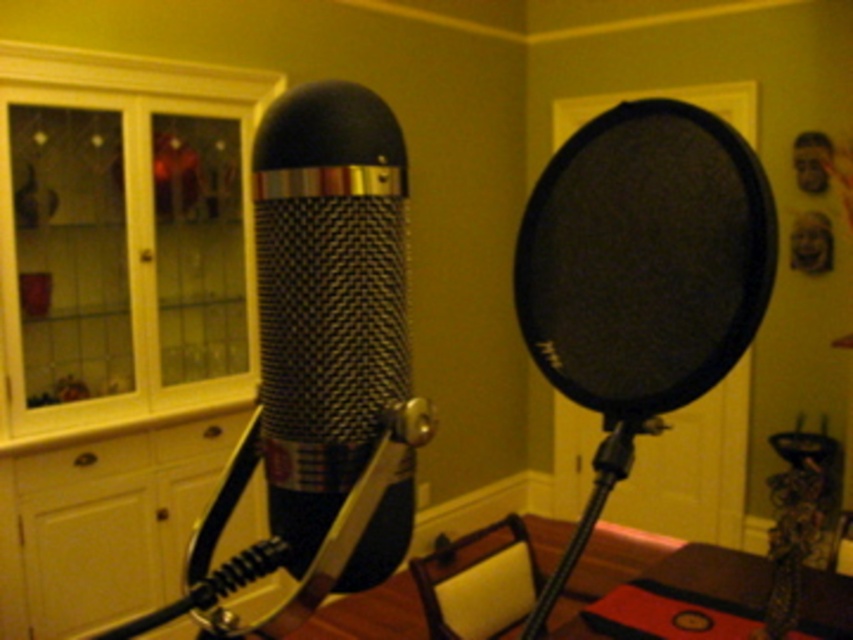
Question: Which point appears farthest from the camera in this image?

Choices:
 (A) (589, 164)
 (B) (308, 124)

Answer: (A)

Question: Among these points, which one is nearest to the camera?

Choices:
 (A) (720, 145)
 (B) (287, 483)

Answer: (B)

Question: Does black mesh speaker at center have a larger size compared to textured black microphone at center?

Choices:
 (A) no
 (B) yes

Answer: (B)

Question: Is black mesh speaker at center closer to camera compared to textured black microphone at center?

Choices:
 (A) yes
 (B) no

Answer: (B)

Question: In this image, where is black mesh speaker at center located relative to textured black microphone at center?

Choices:
 (A) right
 (B) left

Answer: (A)